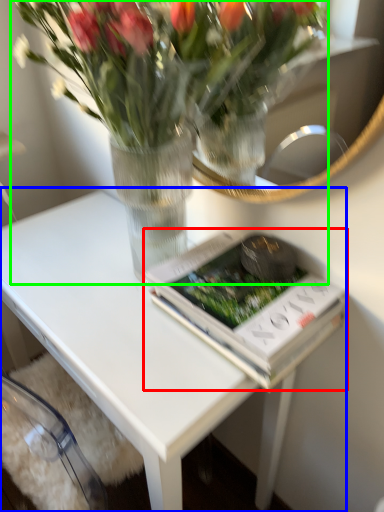
Question: Considering the real-world distances, which object is closest to paperback book (highlighted by a red box)? table (highlighted by a blue box) or houseplant (highlighted by a green box).

Choices:
 (A) table
 (B) houseplant

Answer: (A)